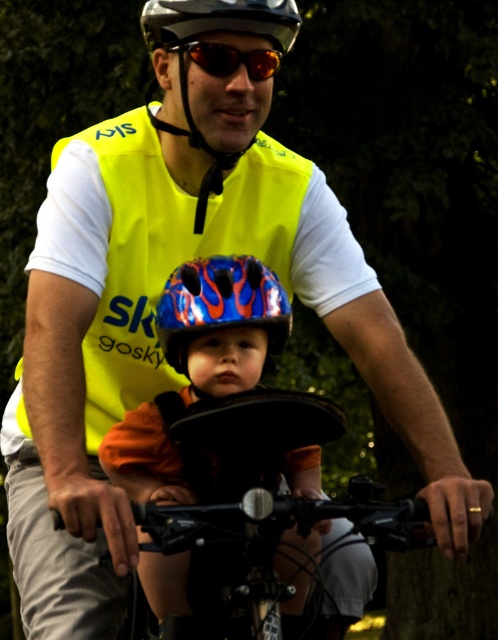
You are a cyclist observing the scene. You notice two helmets at the center of the image. Which helmet is positioned lower between the shiny metallic helmet at center and the shiny black helmet at center?

The shiny metallic helmet at center is located below the shiny black helmet at center, so the shiny metallic helmet at center is positioned lower.

Consider the image. You are a cyclist who needs to check the positioning of the yellow reflective safety vest at center and the shiny black helmet at center. Which object is located to the left of the other?

The yellow reflective safety vest at center is positioned on the left side of shiny black helmet at center.

You are a safety inspector checking the bicycle setup. The yellow reflective safety vest at center and the shiny black helmet at center are both visible from the front. Which object is higher in position?

The yellow reflective safety vest at center is taller than the shiny black helmet at center, so the yellow reflective safety vest at center is higher in position.